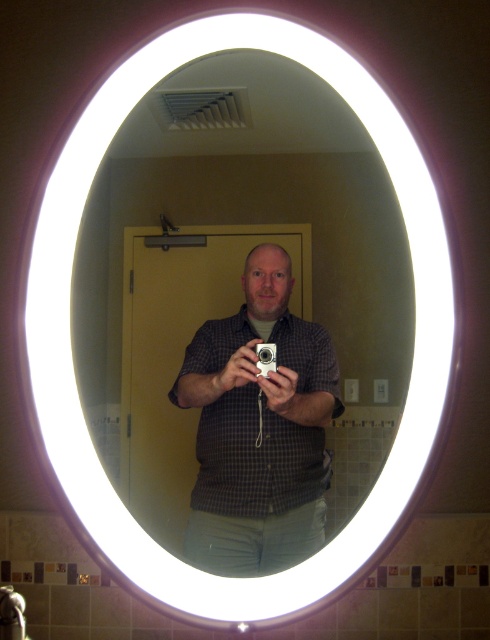
Question: Observing the image, what is the correct spatial positioning of checkered shirt at center in reference to silver metallic camera at center?

Choices:
 (A) right
 (B) left

Answer: (B)

Question: Which of the following is the closest to the observer?

Choices:
 (A) (269, 360)
 (B) (305, 513)

Answer: (A)

Question: Can you confirm if checkered shirt at center is smaller than silver metallic camera at center?

Choices:
 (A) yes
 (B) no

Answer: (B)

Question: Does checkered shirt at center appear over silver metallic camera at center?

Choices:
 (A) yes
 (B) no

Answer: (B)

Question: Which object is farther from the camera taking this photo?

Choices:
 (A) silver metallic camera at center
 (B) checkered shirt at center

Answer: (A)